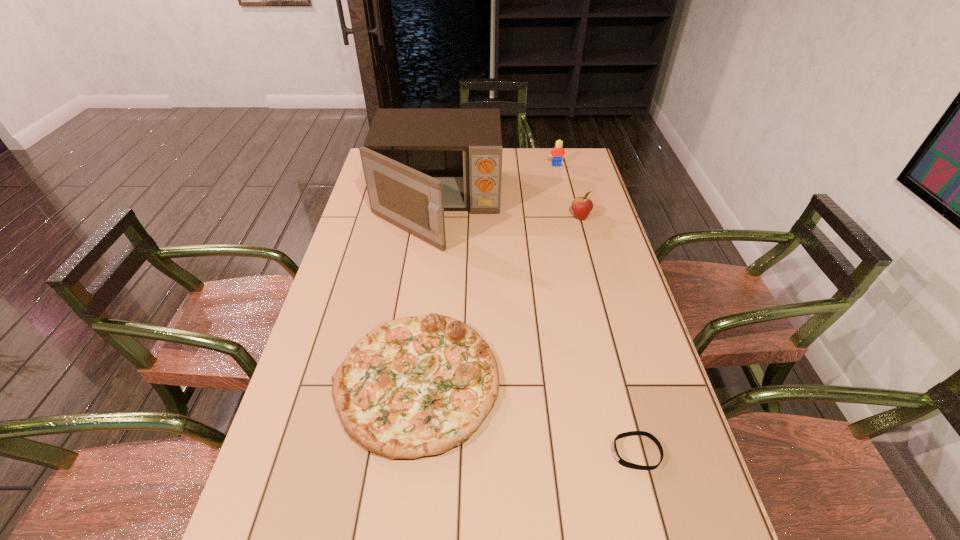
You are a GUI agent. You are given a task and a screenshot of the screen. Output one action in this format:
    pyautogui.click(x=<x>, y=<y>)
    Task: Click on the vacant space that satisfies the following two spatial constraints: 1. with the door open on the front of the tallest object; 2. on the right side of the pizza
    
    Given the screenshot: What is the action you would take?
    pyautogui.click(x=416, y=383)